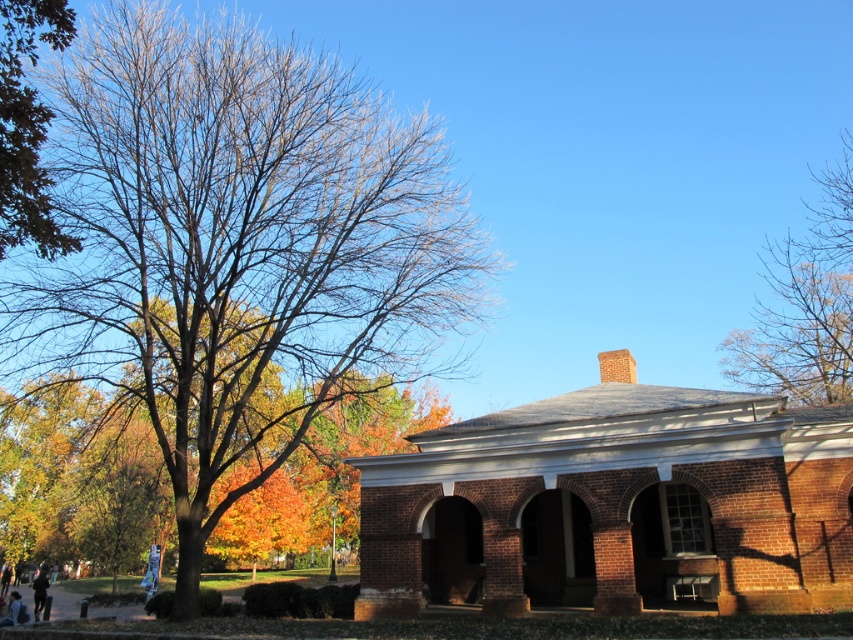
You are a photographer setting up a tripod in the foreground of the scene. You need to position it so that it doesn not block either the black fabric person at lower left or the blue denim jeans at lower left. Given that the tripod has a base width of 30 cm, can you determine if there is enough space between the two objects to place the tripod without overlapping them?

The black fabric person at lower left might be wider than blue denim jeans at lower left, so there is insufficient information to determine if the tripod can be placed between them without overlapping. More details about their exact widths are needed.

You are standing in the outdoor scene and see the black fabric person at lower left and the blue denim jeans at lower left. Which object is positioned lower in the image?

The black fabric person at lower left is positioned below the blue denim jeans at lower left, so it is lower in the image.

In the scene shown: You are standing in front of the historic brick building and notice a green leafy tree at upper left and a black fabric person at lower left. Which object is positioned to the right of the other?

The green leafy tree at upper left is to the right of the black fabric person at lower left.